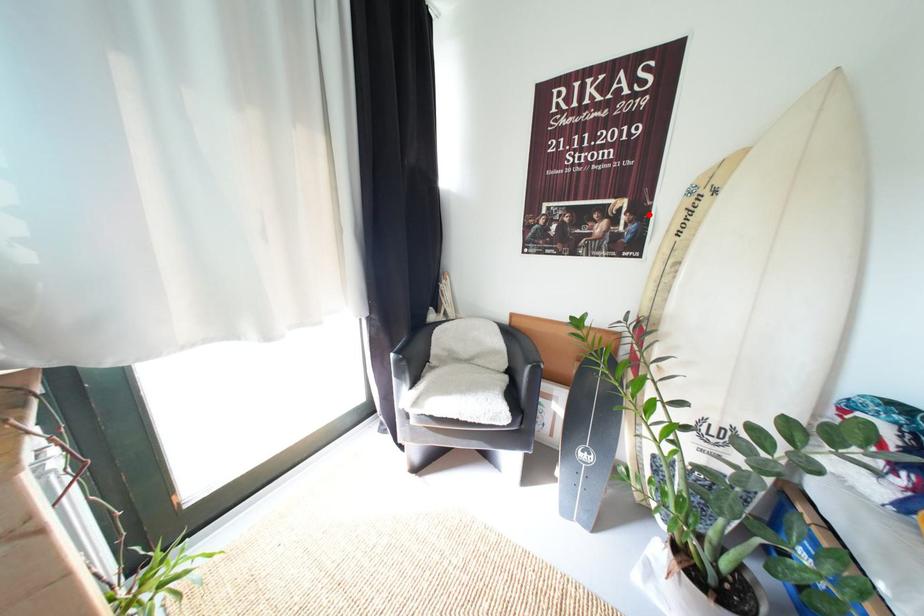
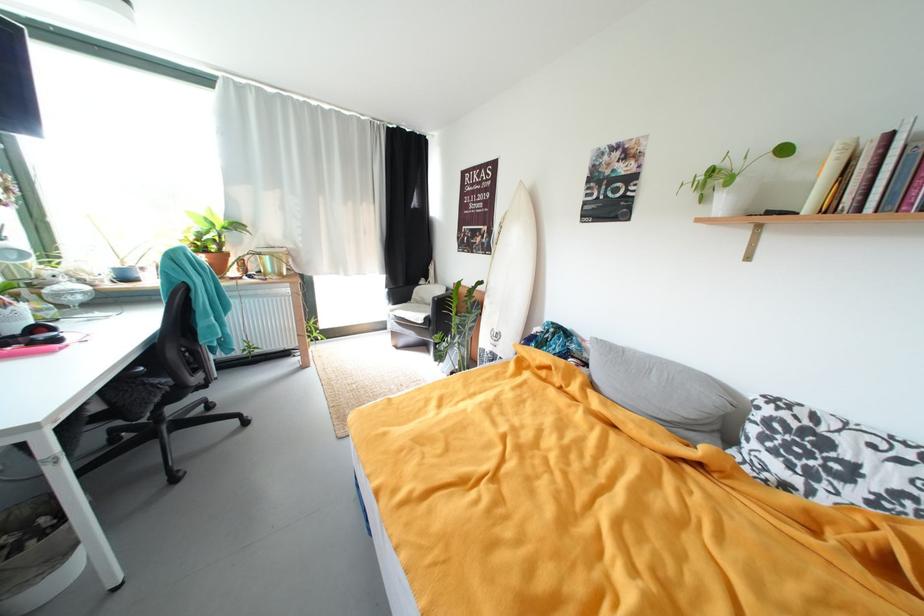
Where in the second image is the point corresponding to the highlighted location from the first image?

(497, 235)